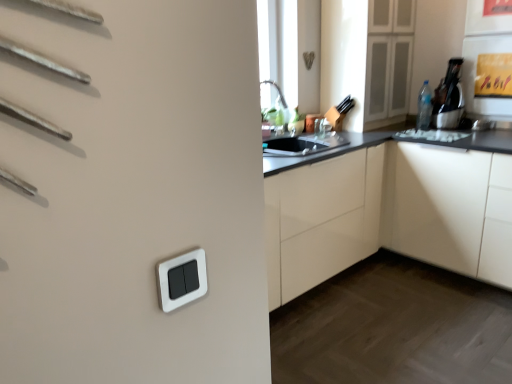
Locate an element on the screen. This screenshot has height=384, width=512. vacant space to the right of silver metallic faucet at upper center is located at coordinates (347, 130).